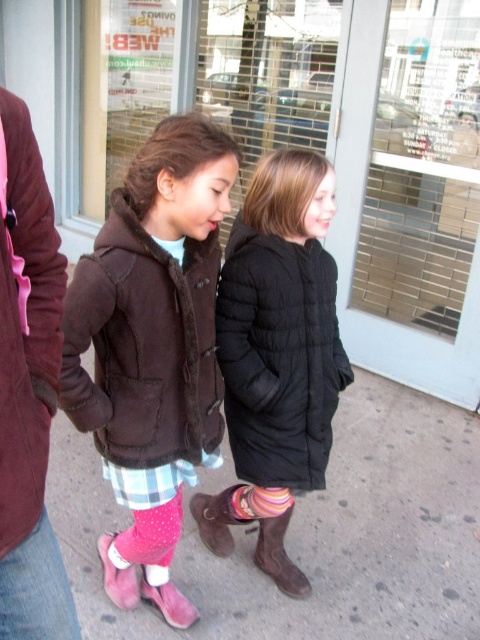
Question: Which object is farther from the camera taking this photo?

Choices:
 (A) maroon fuzzy coat at left
 (B) brown suede boot at center
 (C) pink suede boots at lower center
 (D) brown suede boot at lower center

Answer: (B)

Question: Which object is the farthest from the brown suede boot at lower center?

Choices:
 (A) brown suede boot at center
 (B) pink suede boots at lower center

Answer: (B)

Question: Among these points, which one is nearest to the camera?

Choices:
 (A) (x=62, y=490)
 (B) (x=283, y=529)

Answer: (B)

Question: Is pink suede boots at lower center to the left of maroon fuzzy coat at left from the viewer's perspective?

Choices:
 (A) no
 (B) yes

Answer: (A)

Question: Does pink suede boots at lower center have a larger size compared to pink striped sock at lower center?

Choices:
 (A) yes
 (B) no

Answer: (A)

Question: Does brown suede boot at lower center appear under pink striped sock at lower center?

Choices:
 (A) no
 (B) yes

Answer: (A)